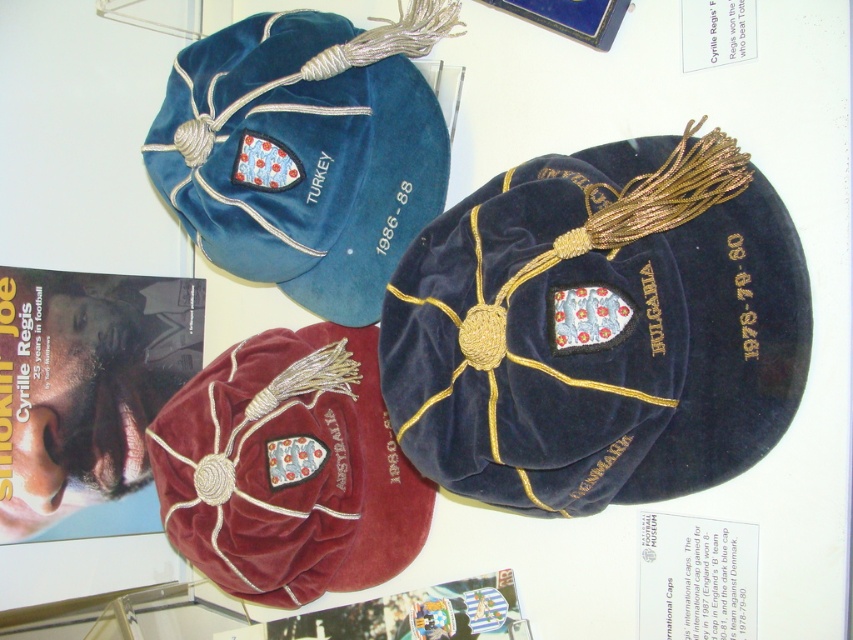
You are organizing a display of national caps and need to ensure proper spacing between them. Given the velvet blue cap at upper left and the maroon velvet cap at center, which one requires more space due to its size?

The velvet blue cap at upper left requires more space because it has a larger size compared to the maroon velvet cap at center.